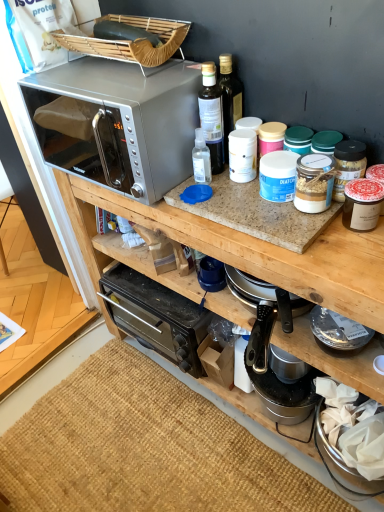
Identify the location of free spot in front of matte glass jar at right, the second appliance from the back. (358, 255).